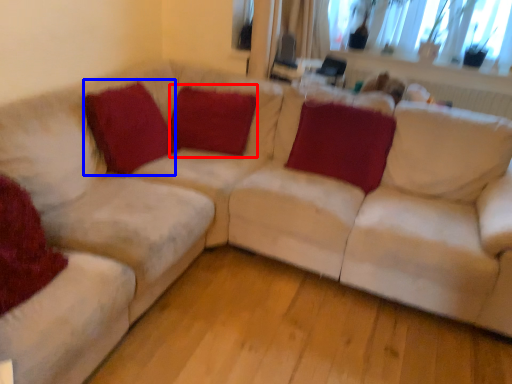
Question: Which of the following is the closest to the observer, pillow (highlighted by a red box) or pillow (highlighted by a blue box)?

Choices:
 (A) pillow
 (B) pillow

Answer: (B)